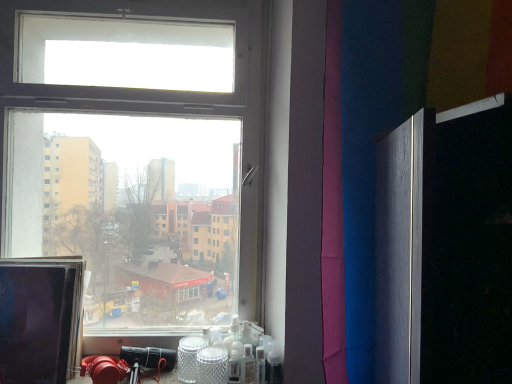
Question: Considering the relative sizes of clear plastic spray bottle at lower center, the 1th toiletry when ordered from left to right, and matte black monitor at left in the image provided, is clear plastic spray bottle at lower center, the 1th toiletry when ordered from left to right, taller than matte black monitor at left?

Choices:
 (A) no
 (B) yes

Answer: (A)

Question: Is clear plastic spray bottle at lower center, the 1th toiletry when ordered from left to right, positioned with its back to matte black monitor at left?

Choices:
 (A) no
 (B) yes

Answer: (A)

Question: From a real-world perspective, does clear plastic spray bottle at lower center, acting as the 2th toiletry starting from the right, sit lower than matte black monitor at left?

Choices:
 (A) yes
 (B) no

Answer: (A)

Question: Is clear plastic spray bottle at lower center, the 1th toiletry when ordered from left to right, positioned behind matte black monitor at left?

Choices:
 (A) no
 (B) yes

Answer: (B)

Question: From a real-world perspective, is clear plastic spray bottle at lower center, acting as the 2th toiletry starting from the right, located higher than matte black monitor at left?

Choices:
 (A) yes
 (B) no

Answer: (B)

Question: From the image's perspective, relative to clear plastic spray bottle at lower center, the 1th toiletry when ordered from left to right, is translucent plastic spray bottle at lower right, which ranks as the 2th toiletry in left-to-right order, above or below?

Choices:
 (A) above
 (B) below

Answer: (A)

Question: Is point (268, 375) closer or farther from the camera than point (250, 377)?

Choices:
 (A) farther
 (B) closer

Answer: (B)

Question: In terms of height, does translucent plastic spray bottle at lower right, which ranks as the 2th toiletry in left-to-right order, look taller or shorter compared to clear plastic spray bottle at lower center, the 1th toiletry when ordered from left to right?

Choices:
 (A) tall
 (B) short

Answer: (A)

Question: Considering their positions, is translucent plastic spray bottle at lower right, which ranks as the 2th toiletry in left-to-right order, located in front of or behind clear plastic spray bottle at lower center, acting as the 2th toiletry starting from the right?

Choices:
 (A) front
 (B) behind

Answer: (A)

Question: Choose the correct answer: Is clear plastic spray bottle at lower center, acting as the 2th toiletry starting from the right, inside purple fabric at right or outside it?

Choices:
 (A) inside
 (B) outside

Answer: (B)

Question: Considering their positions, is clear plastic spray bottle at lower center, the 1th toiletry when ordered from left to right, located in front of or behind purple fabric at right?

Choices:
 (A) behind
 (B) front

Answer: (A)

Question: From a real-world perspective, is clear plastic spray bottle at lower center, acting as the 2th toiletry starting from the right, positioned above or below purple fabric at right?

Choices:
 (A) above
 (B) below

Answer: (B)

Question: Considering the positions of clear plastic spray bottle at lower center, acting as the 2th toiletry starting from the right, and purple fabric at right in the image, is clear plastic spray bottle at lower center, acting as the 2th toiletry starting from the right, bigger or smaller than purple fabric at right?

Choices:
 (A) big
 (B) small

Answer: (B)

Question: Is matte black monitor at left taller or shorter than transparent glass window at center?

Choices:
 (A) short
 (B) tall

Answer: (A)

Question: Considering the positions of point (52, 365) and point (134, 134), is point (52, 365) closer or farther from the camera than point (134, 134)?

Choices:
 (A) farther
 (B) closer

Answer: (B)